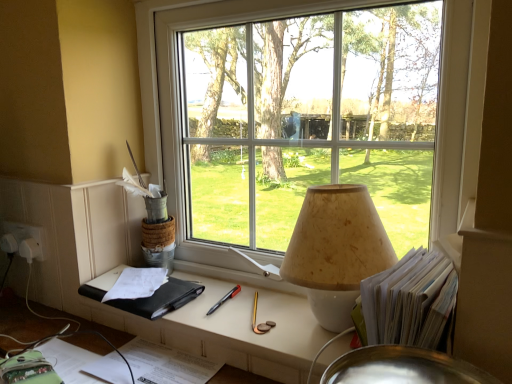
I want to click on vacant space that's between black leather notebook at lower left and beige textured lampshade at center, so click(x=239, y=303).